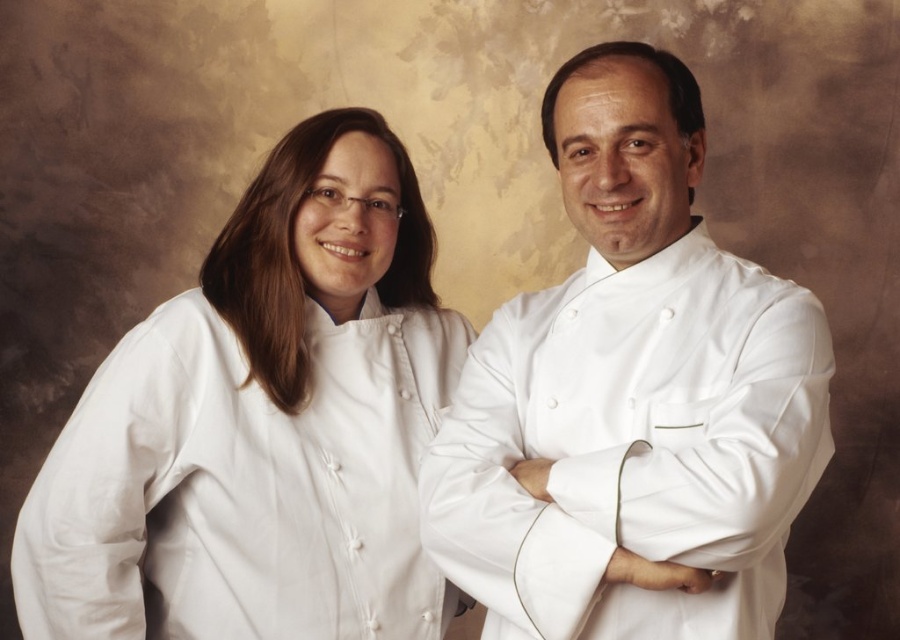
You are a photographer adjusting a camera to focus on two points in the image. The first point is point (670, 307) and the second is point (587, 540). Which point is closer to the camera?

Point (670, 307) is further to the viewer than point (587, 540), so the second point is closer to the camera.

You are a photographer standing in front of the two chefs. You need to take a closeup shot of the white smooth chef coat at left. Can you reach it with your camera lens if you are 1.5 meters away from the coat?

The white smooth chef coat at left is 1.49 meters away from the viewer, which is just within reach of your camera lens since you are 1.5 meters away. Therefore, you can take the closeup shot.